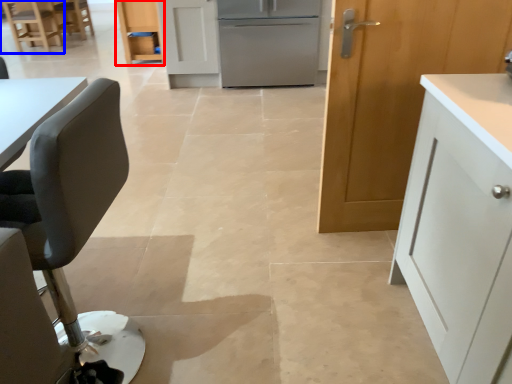
Question: Which object appears farthest to the camera in this image, cabinetry (highlighted by a red box) or chair (highlighted by a blue box)?

Choices:
 (A) cabinetry
 (B) chair

Answer: (B)